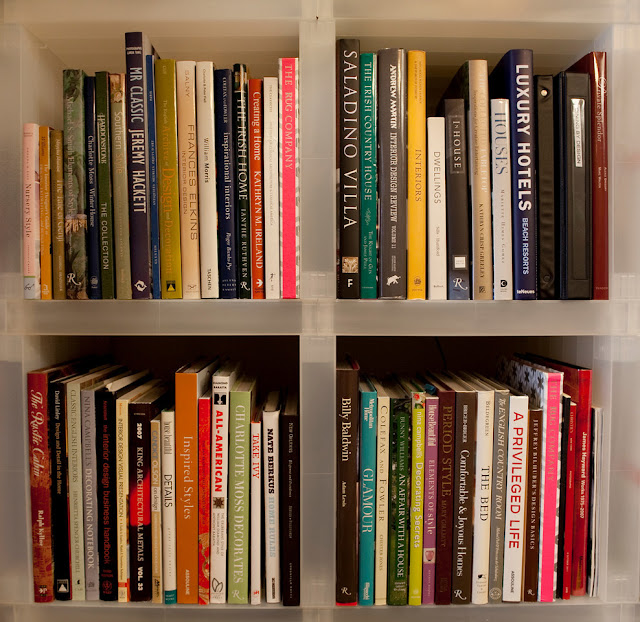
You are a GUI agent. You are given a task and a screenshot of the screen. Output one action in this format:
    pyautogui.click(x=<x>, y=<y>)
    Task: Click on the bookshelf
    The image size is (640, 622).
    Given the screenshot: What is the action you would take?
    pyautogui.click(x=298, y=327)